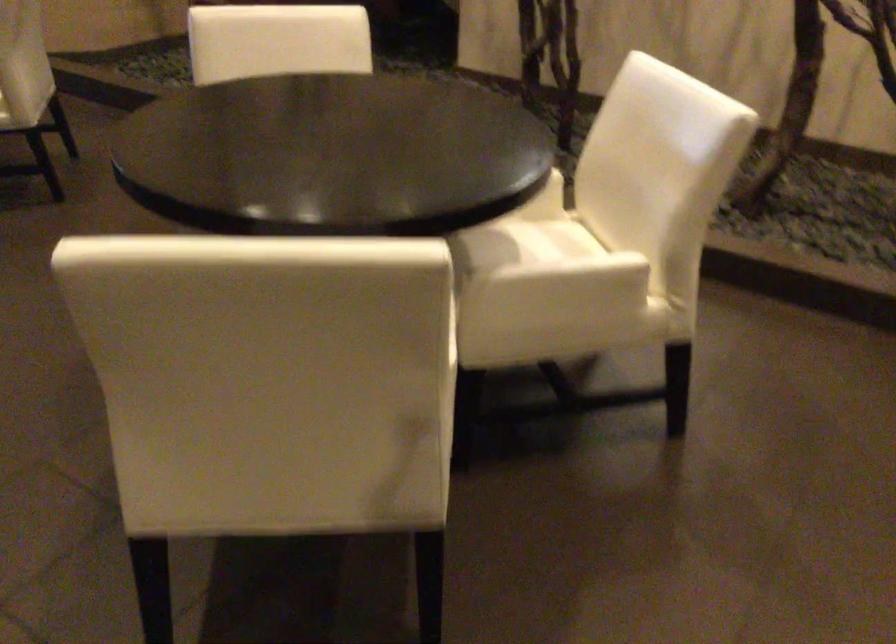
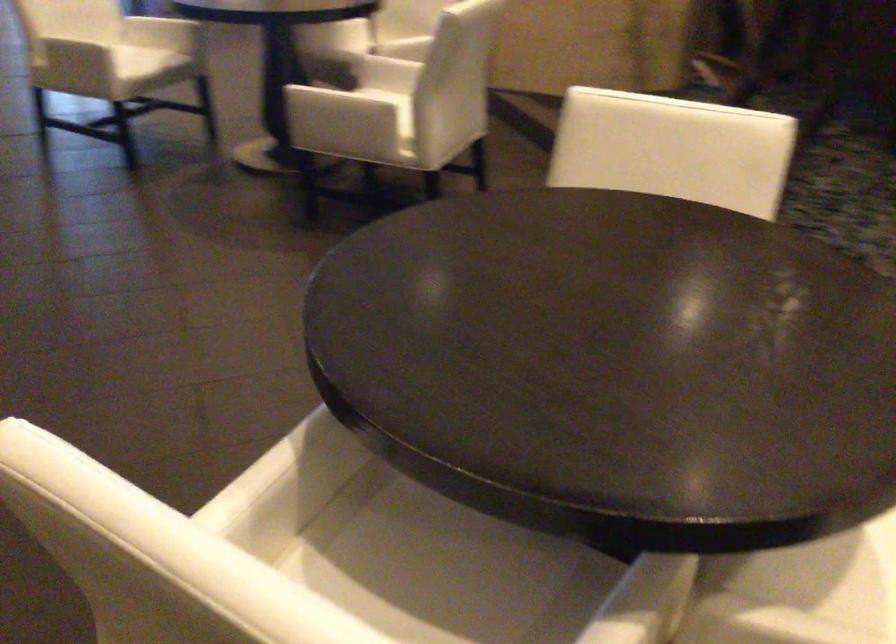
Question: The camera is either moving clockwise (left) or counter-clockwise (right) around the object. The first image is from the beginning of the video and the second image is from the end. Is the camera moving left or right when shooting the video?

Choices:
 (A) Left
 (B) Right

Answer: (B)